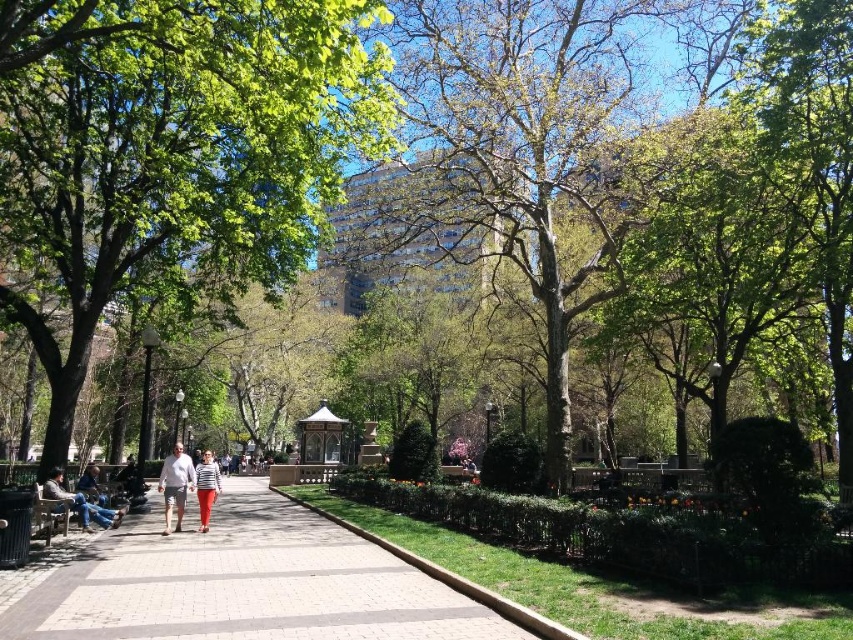
Question: Is light gray shorts at center smaller than wooden park bench at lower left?

Choices:
 (A) no
 (B) yes

Answer: (A)

Question: Estimate the real-world distances between objects in this image. Which object is closer to the green leafy tree at center?

Choices:
 (A) light gray shorts at center
 (B) smooth concrete path at center
 (C) striped fabric pants at center
 (D) denim pants at left

Answer: (A)

Question: Among these points, which one is farthest from the camera?

Choices:
 (A) (27, 323)
 (B) (167, 472)
 (C) (343, 632)
 (D) (67, 502)

Answer: (A)

Question: Does green leafy tree at center have a smaller size compared to striped fabric pants at center?

Choices:
 (A) yes
 (B) no

Answer: (B)

Question: Which object is closer to the camera taking this photo?

Choices:
 (A) striped fabric pants at center
 (B) denim pants at left

Answer: (B)

Question: Is green leafy tree at center positioned in front of denim pants at left?

Choices:
 (A) no
 (B) yes

Answer: (B)